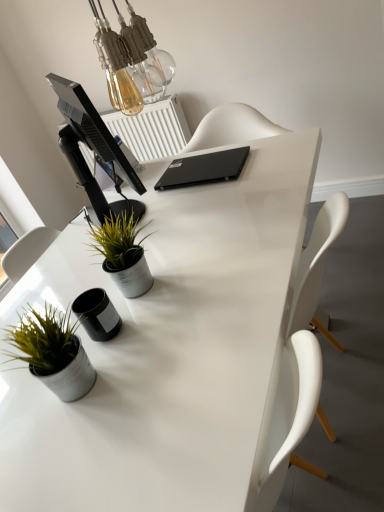
This screenshot has height=512, width=384. Identify the location of vacant area that lies between black matte laptop at center and metallic gray pot at center, the second houseplant positioned from the front. (164, 223).